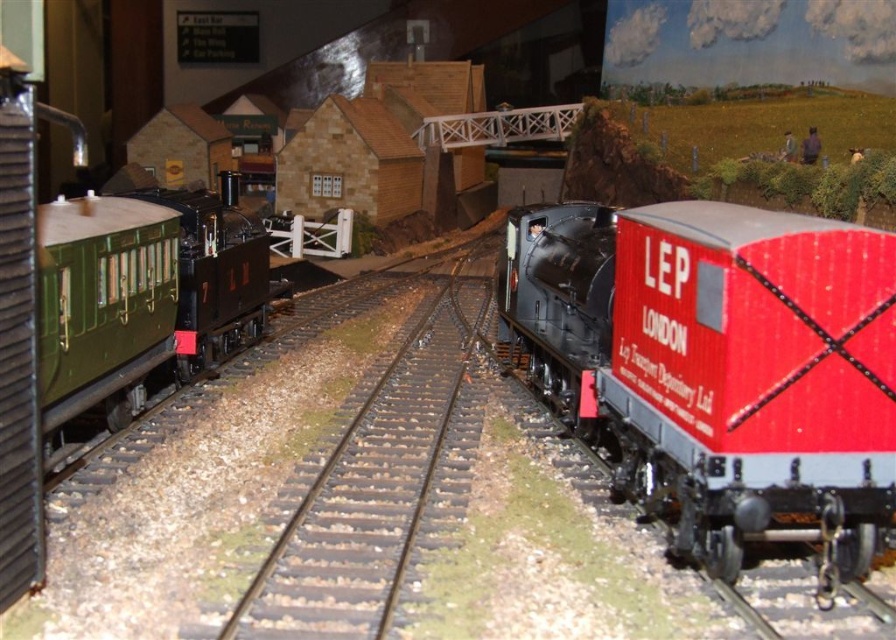
You are a model railway enthusiast inspecting the scene. You notice the green polished wood passenger car at left and the black metal train track at center. Which object is taller?

The green polished wood passenger car at left is taller than the black metal train track at center.

You are a model railway enthusiast examining the scene. You notice the red glossy freight car at center and the green polished wood passenger car at left. Which of these two cars has a taller height?

The red glossy freight car at center has a greater height compared to the green polished wood passenger car at left.

You are a model train enthusiast inspecting the layout. From your viewpoint, which object is closer to you between the red glossy freight car at center and the green polished wood passenger car at left?

The red glossy freight car at center is closer to you because it is positioned in front of the green polished wood passenger car at left.